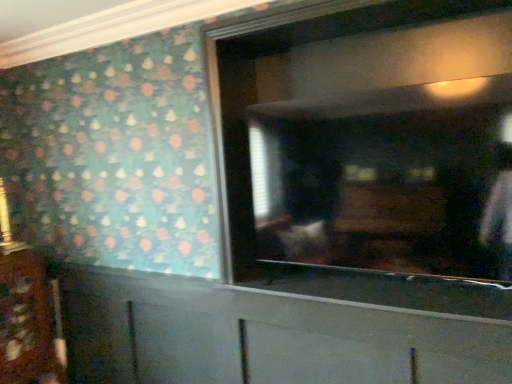
Question: From a real-world perspective, is matte glass mirror at center above or below white matte cabinet at lower center, the second cabinetry when ordered from left to right?

Choices:
 (A) above
 (B) below

Answer: (A)

Question: Is matte glass mirror at center wider or thinner than white matte cabinet at lower center, which is counted as the 1th cabinetry, starting from the right?

Choices:
 (A) wide
 (B) thin

Answer: (A)

Question: Based on their relative distances, which object is farther from the wooden cabinet at lower left, marked as the second cabinetry in a right-to-left arrangement?

Choices:
 (A) white matte cabinet at lower center, the second cabinetry when ordered from left to right
 (B) matte glass mirror at center

Answer: (B)

Question: Which object is the farthest from the wooden cabinet at lower left, which is counted as the 1th cabinetry, starting from the left?

Choices:
 (A) matte glass mirror at center
 (B) white matte cabinet at lower center, which is counted as the 1th cabinetry, starting from the right

Answer: (A)